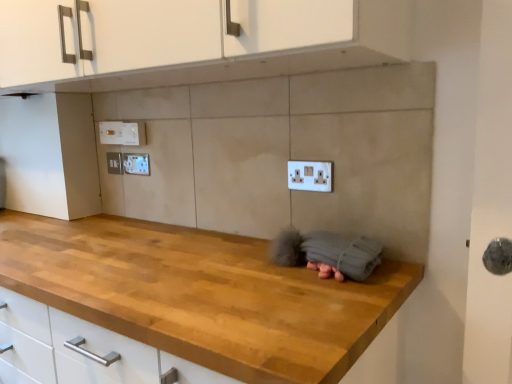
The width and height of the screenshot is (512, 384). Describe the element at coordinates (136, 163) in the screenshot. I see `white plastic electric outlet at upper left, which is the third electric outlet in left-to-right order` at that location.

The height and width of the screenshot is (384, 512). Find the location of `white plastic electric outlet at upper left, the second electric outlet when ordered from front to back`. white plastic electric outlet at upper left, the second electric outlet when ordered from front to back is located at coordinates tap(136, 163).

I want to click on white plastic electric outlet at upper left, arranged as the 1th electric outlet when viewed from the back, so click(x=114, y=163).

Does white plastic electric outlet at center, placed as the fourth electric outlet when sorted from back to front, have a greater width compared to white plastic electric outlet at upper left, positioned as the 4th electric outlet in right-to-left order?

Indeed, white plastic electric outlet at center, placed as the fourth electric outlet when sorted from back to front, has a greater width compared to white plastic electric outlet at upper left, positioned as the 4th electric outlet in right-to-left order.

From the image's perspective, relative to white plastic electric outlet at upper left, positioned as the 4th electric outlet in front-to-back order, is white plastic electric outlet at center, which is the fourth electric outlet in left-to-right order, above or below?

white plastic electric outlet at center, which is the fourth electric outlet in left-to-right order, is below white plastic electric outlet at upper left, positioned as the 4th electric outlet in front-to-back order.

Considering the relative positions of white plastic electric outlet at center, placed as the fourth electric outlet when sorted from back to front, and white plastic electric outlet at upper left, positioned as the 4th electric outlet in right-to-left order, in the image provided, is white plastic electric outlet at center, placed as the fourth electric outlet when sorted from back to front, to the right of white plastic electric outlet at upper left, positioned as the 4th electric outlet in right-to-left order, from the viewer's perspective?

Correct, you'll find white plastic electric outlet at center, placed as the fourth electric outlet when sorted from back to front, to the right of white plastic electric outlet at upper left, positioned as the 4th electric outlet in right-to-left order.

Is white plastic electric outlet at center, placed as the fourth electric outlet when sorted from back to front, not within white plastic electric outlet at upper left, arranged as the 1th electric outlet when viewed from the back?

Yes.

In the scene shown: Between white plastic electric outlet at upper left, positioned as the 4th electric outlet in front-to-back order, and white plastic electric outlet at center, placed as the fourth electric outlet when sorted from back to front, which one has more height?

white plastic electric outlet at center, placed as the fourth electric outlet when sorted from back to front, is taller.

Considering the relative sizes of white plastic electric outlet at upper left, marked as the first electric outlet in a left-to-right arrangement, and white plastic electric outlet at center, which is counted as the 1th electric outlet, starting from the front, in the image provided, is white plastic electric outlet at upper left, marked as the first electric outlet in a left-to-right arrangement, wider than white plastic electric outlet at center, which is counted as the 1th electric outlet, starting from the front,?

Incorrect, the width of white plastic electric outlet at upper left, marked as the first electric outlet in a left-to-right arrangement, does not surpass that of white plastic electric outlet at center, which is counted as the 1th electric outlet, starting from the front.

Considering the positions of objects white plastic electric outlet at upper left, marked as the first electric outlet in a left-to-right arrangement, and white plastic electric outlet at center, placed as the fourth electric outlet when sorted from back to front, in the image provided, who is more to the left, white plastic electric outlet at upper left, marked as the first electric outlet in a left-to-right arrangement, or white plastic electric outlet at center, placed as the fourth electric outlet when sorted from back to front,?

Positioned to the left is white plastic electric outlet at upper left, marked as the first electric outlet in a left-to-right arrangement.

Between point (143, 137) and point (298, 189), which one is positioned behind?

Positioned behind is point (143, 137).

Considering the relative positions of white plastic electric outlet at upper left, which is the third electric outlet from right to left, and white plastic electric outlet at center, which is the fourth electric outlet in left-to-right order, in the image provided, is white plastic electric outlet at upper left, which is the third electric outlet from right to left, to the right of white plastic electric outlet at center, which is the fourth electric outlet in left-to-right order, from the viewer's perspective?

No.

Considering the relative sizes of white plastic electric outlet at upper left, positioned as the 2th electric outlet in left-to-right order, and white plastic electric outlet at center, which is counted as the 1th electric outlet, starting from the front, in the image provided, is white plastic electric outlet at upper left, positioned as the 2th electric outlet in left-to-right order, taller than white plastic electric outlet at center, which is counted as the 1th electric outlet, starting from the front,?

Incorrect, the height of white plastic electric outlet at upper left, positioned as the 2th electric outlet in left-to-right order, is not larger of that of white plastic electric outlet at center, which is counted as the 1th electric outlet, starting from the front.

From a real-world perspective, which object stands above the other?

From a 3D spatial view, white plastic electric outlet at upper left, marked as the 3th electric outlet in a front-to-back arrangement, is above.

From a real-world perspective, between white plastic electric outlet at upper left, the third electric outlet when ordered from back to front, and white plastic electric outlet at center, which is the fourth electric outlet in left-to-right order, who is vertically higher?

white plastic electric outlet at upper left, the third electric outlet when ordered from back to front.

Is point (127, 161) less distant than point (309, 190)?

No, it is not.

Considering the relative sizes of white plastic electric outlet at upper left, the second electric outlet when ordered from front to back, and white plastic electric outlet at center, placed as the fourth electric outlet when sorted from back to front, in the image provided, is white plastic electric outlet at upper left, the second electric outlet when ordered from front to back, wider than white plastic electric outlet at center, placed as the fourth electric outlet when sorted from back to front,?

No, white plastic electric outlet at upper left, the second electric outlet when ordered from front to back, is not wider than white plastic electric outlet at center, placed as the fourth electric outlet when sorted from back to front.

Is white plastic electric outlet at upper left, the second electric outlet positioned from the right, looking in the opposite direction of white plastic electric outlet at upper left, arranged as the 1th electric outlet when viewed from the back?

No, white plastic electric outlet at upper left, the second electric outlet positioned from the right, is not facing away from white plastic electric outlet at upper left, arranged as the 1th electric outlet when viewed from the back.

From a real-world perspective, which object stands above the other?

white plastic electric outlet at upper left, positioned as the 4th electric outlet in front-to-back order, from a real-world perspective.

Which object is positioned more to the right, white plastic electric outlet at upper left, the second electric outlet positioned from the right, or white plastic electric outlet at upper left, positioned as the 4th electric outlet in right-to-left order?

Positioned to the right is white plastic electric outlet at upper left, the second electric outlet positioned from the right.

From the image's perspective, which one is positioned lower, white plastic electric outlet at upper left, which is the third electric outlet in left-to-right order, or white plastic electric outlet at upper left, positioned as the 4th electric outlet in right-to-left order?

white plastic electric outlet at upper left, which is the third electric outlet in left-to-right order, appears lower in the image.

Do you think white plastic electric outlet at upper left, arranged as the 1th electric outlet when viewed from the back, is within white plastic electric outlet at upper left, the second electric outlet positioned from the back, or outside of it?

white plastic electric outlet at upper left, arranged as the 1th electric outlet when viewed from the back, cannot be found inside white plastic electric outlet at upper left, the second electric outlet positioned from the back.

From the picture: Is the surface of white plastic electric outlet at upper left, positioned as the 4th electric outlet in front-to-back order, in direct contact with white plastic electric outlet at upper left, positioned as the 2th electric outlet in left-to-right order?

No, white plastic electric outlet at upper left, positioned as the 4th electric outlet in front-to-back order, is not touching white plastic electric outlet at upper left, positioned as the 2th electric outlet in left-to-right order.

From the image's perspective, is white plastic electric outlet at upper left, arranged as the 1th electric outlet when viewed from the back, on top of white plastic electric outlet at upper left, the second electric outlet positioned from the back?

No, from the image's perspective, white plastic electric outlet at upper left, arranged as the 1th electric outlet when viewed from the back, is not on top of white plastic electric outlet at upper left, the second electric outlet positioned from the back.

Is white plastic electric outlet at upper left, marked as the 3th electric outlet in a front-to-back arrangement, not close to white plastic electric outlet at upper left, the second electric outlet positioned from the right?

No, white plastic electric outlet at upper left, marked as the 3th electric outlet in a front-to-back arrangement, is not far away from white plastic electric outlet at upper left, the second electric outlet positioned from the right.

Which of these two, white plastic electric outlet at upper left, the second electric outlet positioned from the back, or white plastic electric outlet at upper left, which is the third electric outlet in left-to-right order, is bigger?

With larger size is white plastic electric outlet at upper left, the second electric outlet positioned from the back.

How different are the orientations of white plastic electric outlet at upper left, the second electric outlet positioned from the back, and white plastic electric outlet at upper left, the second electric outlet positioned from the right, in degrees?

The angle between the facing direction of white plastic electric outlet at upper left, the second electric outlet positioned from the back, and the facing direction of white plastic electric outlet at upper left, the second electric outlet positioned from the right, is 2.3 degrees.

Is white plastic electric outlet at upper left, positioned as the 2th electric outlet in left-to-right order, positioned with its back to white plastic electric outlet at upper left, the second electric outlet positioned from the right?

white plastic electric outlet at upper left, positioned as the 2th electric outlet in left-to-right order, does not have its back to white plastic electric outlet at upper left, the second electric outlet positioned from the right.

Find the location of a particular element. The image size is (512, 384). electric outlet that is the 3rd one when counting backward from the white plastic electric outlet at center, placed as the fourth electric outlet when sorted from back to front is located at coordinates (114, 163).

At what (x,y) coordinates should I click in order to perform the action: click on electric outlet that is the 2nd one when counting downward from the white plastic electric outlet at upper left, positioned as the 4th electric outlet in right-to-left order (from the image's perspective). Please return your answer as a coordinate pair (x, y). The width and height of the screenshot is (512, 384). Looking at the image, I should click on (310, 175).

Considering their positions, is white plastic electric outlet at center, which is the fourth electric outlet in left-to-right order, positioned closer to white plastic electric outlet at upper left, which is the third electric outlet in left-to-right order, than white plastic electric outlet at upper left, the second electric outlet positioned from the back?

The object closer to white plastic electric outlet at upper left, which is the third electric outlet in left-to-right order, is white plastic electric outlet at upper left, the second electric outlet positioned from the back.

Looking at the image, which one is located closer to white plastic electric outlet at upper left, which is the third electric outlet from right to left, white plastic electric outlet at center, which is counted as the 1th electric outlet, starting from the front, or white plastic electric outlet at upper left, which is the third electric outlet in left-to-right order?

white plastic electric outlet at upper left, which is the third electric outlet in left-to-right order, is positioned closer to the anchor white plastic electric outlet at upper left, which is the third electric outlet from right to left.

Considering their positions, is white plastic electric outlet at upper left, the second electric outlet positioned from the back, positioned closer to white plastic electric outlet at upper left, positioned as the 4th electric outlet in front-to-back order, than white plastic electric outlet at center, the first electric outlet positioned from the right?

Among the two, white plastic electric outlet at upper left, the second electric outlet positioned from the back, is located nearer to white plastic electric outlet at upper left, positioned as the 4th electric outlet in front-to-back order.

Considering their positions, is white plastic electric outlet at upper left, marked as the 3th electric outlet in a front-to-back arrangement, positioned closer to white plastic electric outlet at upper left, the second electric outlet positioned from the right, than white plastic electric outlet at upper left, marked as the first electric outlet in a left-to-right arrangement?

white plastic electric outlet at upper left, marked as the first electric outlet in a left-to-right arrangement, is closer to white plastic electric outlet at upper left, the second electric outlet positioned from the right.

Looking at the image, which one is located closer to white plastic electric outlet at upper left, arranged as the 1th electric outlet when viewed from the back, white plastic electric outlet at upper left, which is the third electric outlet in left-to-right order, or white plastic electric outlet at center, the first electric outlet positioned from the right?

white plastic electric outlet at upper left, which is the third electric outlet in left-to-right order, is closer to white plastic electric outlet at upper left, arranged as the 1th electric outlet when viewed from the back.

When comparing their distances from white plastic electric outlet at upper left, arranged as the 1th electric outlet when viewed from the back, does white plastic electric outlet at center, which is counted as the 1th electric outlet, starting from the front, or white plastic electric outlet at upper left, which is the third electric outlet in left-to-right order, seem closer?

Among the two, white plastic electric outlet at upper left, which is the third electric outlet in left-to-right order, is located nearer to white plastic electric outlet at upper left, arranged as the 1th electric outlet when viewed from the back.

Looking at the image, which one is located further to white plastic electric outlet at upper left, which is the third electric outlet in left-to-right order, white plastic electric outlet at upper left, positioned as the 4th electric outlet in right-to-left order, or white plastic electric outlet at center, the first electric outlet positioned from the right?

white plastic electric outlet at center, the first electric outlet positioned from the right, is further to white plastic electric outlet at upper left, which is the third electric outlet in left-to-right order.

Which object lies further to the anchor point white plastic electric outlet at upper left, the second electric outlet positioned from the right, white plastic electric outlet at upper left, marked as the 3th electric outlet in a front-to-back arrangement, or white plastic electric outlet at center, the first electric outlet positioned from the right?

The object further to white plastic electric outlet at upper left, the second electric outlet positioned from the right, is white plastic electric outlet at center, the first electric outlet positioned from the right.

At what (x,y) coordinates should I click in order to perform the action: click on electric outlet located between white plastic electric outlet at upper left, marked as the 3th electric outlet in a front-to-back arrangement, and white plastic electric outlet at center, placed as the fourth electric outlet when sorted from back to front, in the left-right direction. Please return your answer as a coordinate pair (x, y). The width and height of the screenshot is (512, 384). Looking at the image, I should click on (136, 163).

Where is `electric outlet between white plastic electric outlet at upper left, which is the third electric outlet from right to left, and white plastic electric outlet at upper left, the second electric outlet when ordered from front to back, in the up-down direction`? electric outlet between white plastic electric outlet at upper left, which is the third electric outlet from right to left, and white plastic electric outlet at upper left, the second electric outlet when ordered from front to back, in the up-down direction is located at coordinates (114, 163).